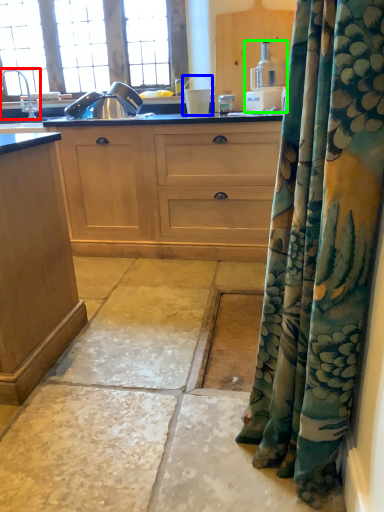
Question: Based on their relative distances, which object is nearer to faucet (highlighted by a red box)? Choose from appliance (highlighted by a blue box) and kitchen appliance (highlighted by a green box).

Choices:
 (A) appliance
 (B) kitchen appliance

Answer: (A)